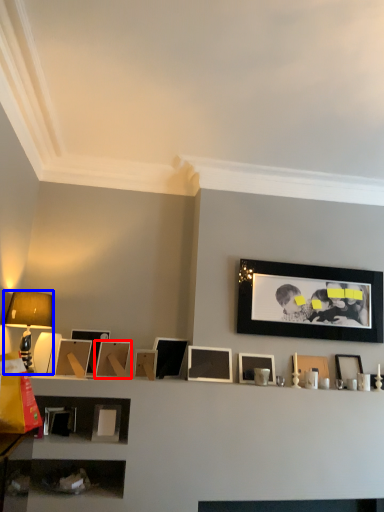
Question: Which object is further to the camera taking this photo, picture frame (highlighted by a red box) or table lamp (highlighted by a blue box)?

Choices:
 (A) picture frame
 (B) table lamp

Answer: (A)